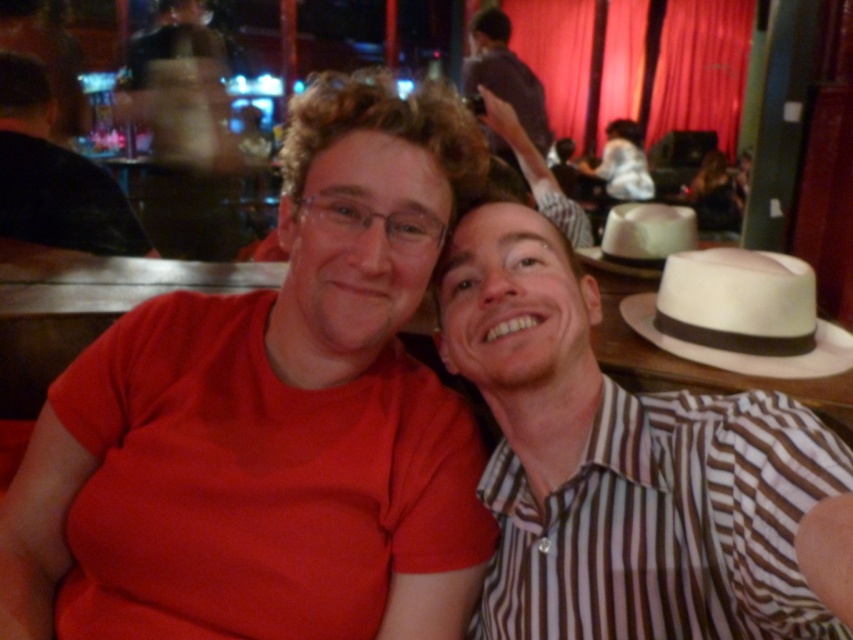
Question: From the image, what is the correct spatial relationship of striped cotton shirt at right in relation to dark brown hair at upper right?

Choices:
 (A) right
 (B) left

Answer: (B)

Question: Which object appears closest to the camera in this image?

Choices:
 (A) dark purple shirt at upper center
 (B) striped cotton shirt at right

Answer: (B)

Question: Can you confirm if striped cotton shirt at right is thinner than matte black shirt at center?

Choices:
 (A) yes
 (B) no

Answer: (A)

Question: Observing the image, what is the correct spatial positioning of dark purple shirt at upper center in reference to white felt cowboy hat at upper right?

Choices:
 (A) right
 (B) left

Answer: (B)

Question: Which object appears farthest from the camera in this image?

Choices:
 (A) matte black shirt at center
 (B) white felt cowboy hat at upper right
 (C) dark purple shirt at upper center

Answer: (C)

Question: Considering the real-world distances, which object is closest to the dark brown hair at upper right?

Choices:
 (A) white felt cowboy hat at upper right
 (B) white felt cowboy hat at right
 (C) striped cotton shirt at right
 (D) dark purple shirt at upper center

Answer: (D)